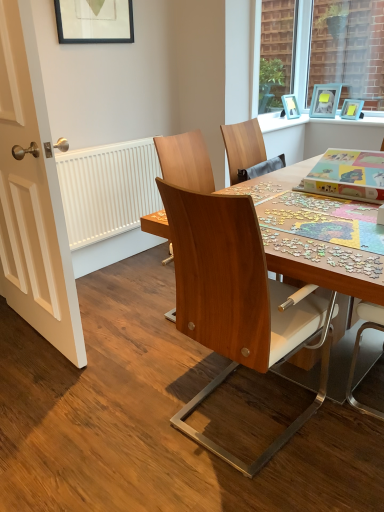
Question: Is point (231, 198) positioned closer to the camera than point (311, 96)?

Choices:
 (A) farther
 (B) closer

Answer: (B)

Question: Would you say wooden chair at center, which appears as the 1th chair when viewed from the right, is to the left or to the right of light blue plastic picture frame at upper right, the third picture frame viewed from the front, in the picture?

Choices:
 (A) left
 (B) right

Answer: (A)

Question: Estimate the real-world distances between objects in this image. Which object is farther from the white matte radiator at left?

Choices:
 (A) wooden chair at center, the second chair when ordered from left to right
 (B) matte black picture frame at upper left, which is the third picture frame from right to left
 (C) light blue plastic picture frame at upper right, the third picture frame viewed from the front
 (D) wooden chair at center, acting as the 2th chair starting from the right
 (E) matte blue picture frame at upper right, the 2th picture frame when ordered from back to front

Answer: (E)

Question: Which object is the closest to the white matte radiator at left?

Choices:
 (A) wooden chair at center, which appears as the 1th chair when viewed from the right
 (B) wooden chair at center, acting as the 2th chair starting from the right
 (C) matte black picture frame at upper left, which is the third picture frame from right to left
 (D) white painted wood door at left
 (E) matte blue picture frame at upper right, which ranks as the third picture frame in left-to-right order

Answer: (B)